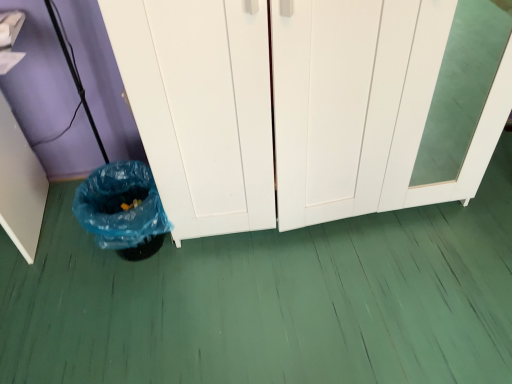
What are the coordinates of `free space in front of blue plastic bag at lower left` in the screenshot? It's located at (125, 307).